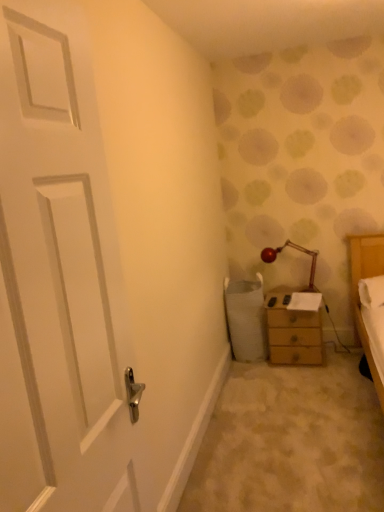
Question: From the image's perspective, is wooden chest of drawers at right beneath white matte door at left?

Choices:
 (A) no
 (B) yes

Answer: (B)

Question: From a real-world perspective, is wooden chest of drawers at right positioned over white matte door at left based on gravity?

Choices:
 (A) no
 (B) yes

Answer: (A)

Question: Is wooden chest of drawers at right positioned in front of white matte door at left?

Choices:
 (A) no
 (B) yes

Answer: (A)

Question: Can you confirm if wooden chest of drawers at right is shorter than white matte door at left?

Choices:
 (A) yes
 (B) no

Answer: (A)

Question: Could you tell me if wooden chest of drawers at right is turned towards white matte door at left?

Choices:
 (A) yes
 (B) no

Answer: (A)

Question: Is wooden chest of drawers at right to the left of white matte door at left from the viewer's perspective?

Choices:
 (A) no
 (B) yes

Answer: (A)

Question: Could wooden chest of drawers at right be considered to be inside white matte door at left?

Choices:
 (A) no
 (B) yes

Answer: (A)

Question: From a real-world perspective, is white matte door at left beneath wooden chest of drawers at right?

Choices:
 (A) yes
 (B) no

Answer: (B)

Question: From the image's perspective, is white matte door at left located beneath wooden chest of drawers at right?

Choices:
 (A) yes
 (B) no

Answer: (B)

Question: Considering the relative positions of white matte door at left and wooden chest of drawers at right in the image provided, is white matte door at left to the right of wooden chest of drawers at right from the viewer's perspective?

Choices:
 (A) yes
 (B) no

Answer: (B)

Question: Is white matte door at left to the left of wooden chest of drawers at right from the viewer's perspective?

Choices:
 (A) no
 (B) yes

Answer: (B)

Question: Is white matte door at left beside wooden chest of drawers at right?

Choices:
 (A) yes
 (B) no

Answer: (B)

Question: Is matte red lamp at upper right beside white matte door at left?

Choices:
 (A) yes
 (B) no

Answer: (B)